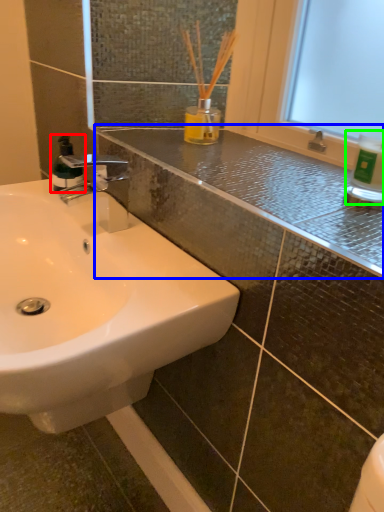
Question: Considering the real-world distances, which object is farthest from mouthwash (highlighted by a red box)? counter top (highlighted by a blue box) or bottle (highlighted by a green box)?

Choices:
 (A) counter top
 (B) bottle

Answer: (B)